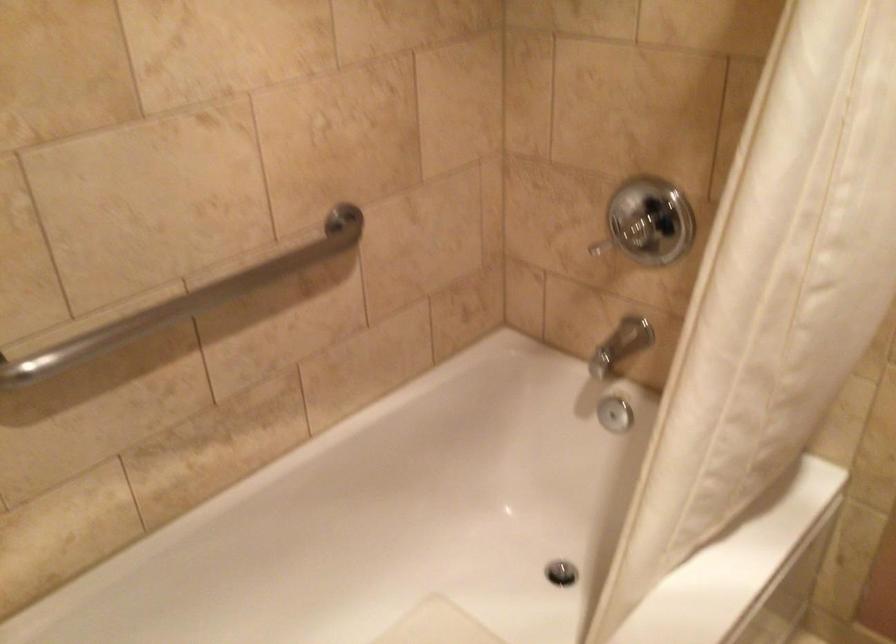
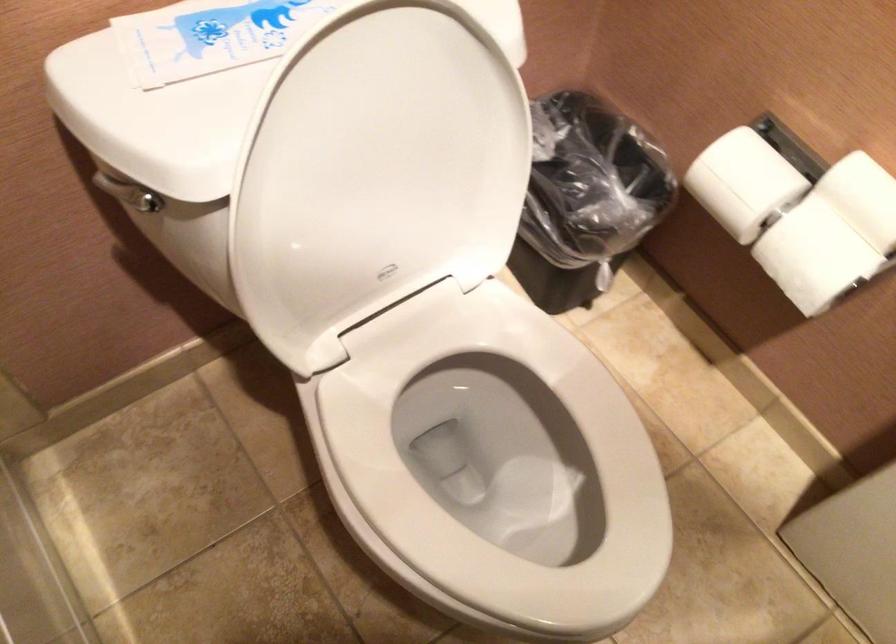
Based on the continuous images, in which direction is the camera rotating?

The camera's rotation is toward right-down.